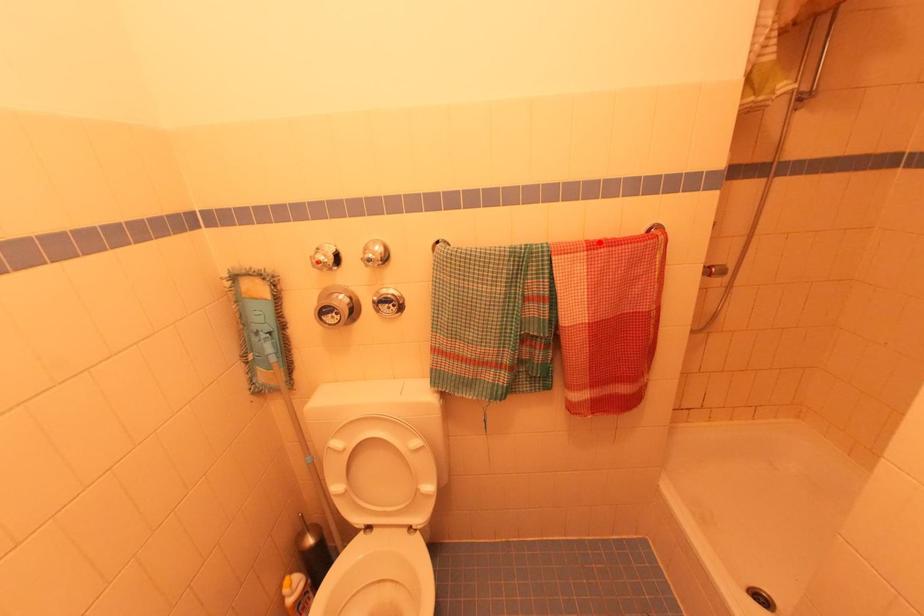
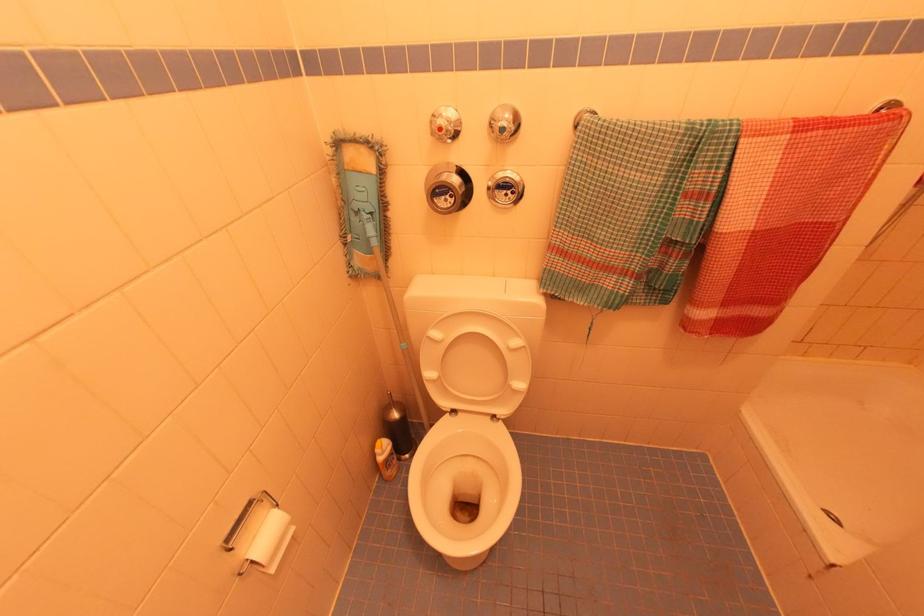
Locate, in the second image, the point that corresponds to the highlighted location in the first image.

(812, 122)